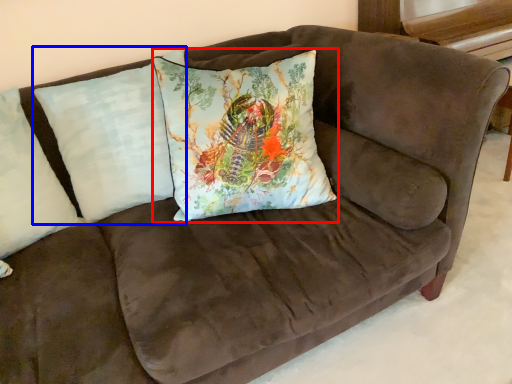
Question: Among these objects, which one is nearest to the camera, pillow (highlighted by a red box) or pillow (highlighted by a blue box)?

Choices:
 (A) pillow
 (B) pillow

Answer: (A)